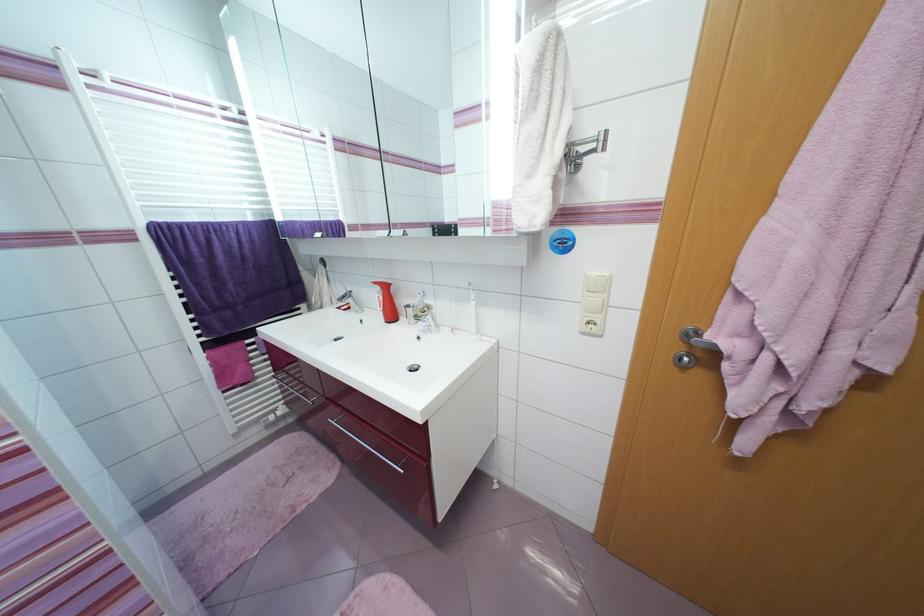
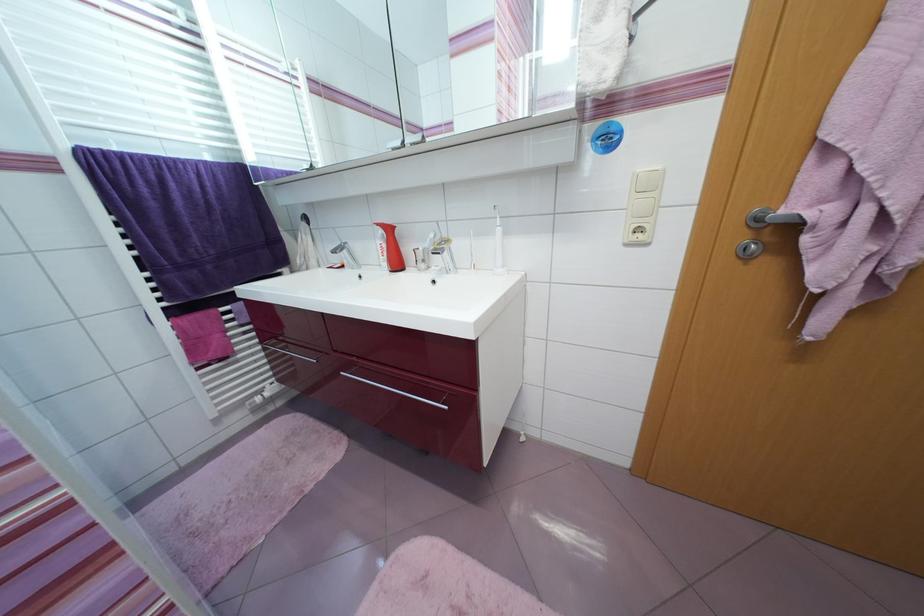
Locate, in the second image, the point that corresponds to point 686,350 in the first image.

(748, 238)